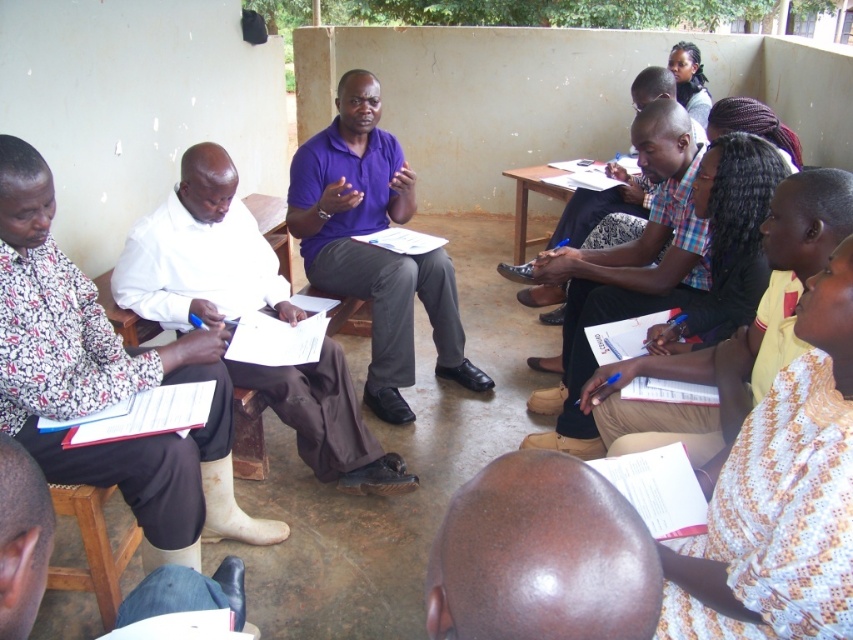
Who is positioned more to the left, shiny brown head at center or light brown fabric at center?

shiny brown head at center

Measure the distance from shiny brown head at center to light brown fabric at center.

shiny brown head at center is 1.79 meters away from light brown fabric at center.

Between point (519, 637) and point (595, 310), which one is positioned behind?

The point (595, 310) is more distant.

Locate an element on the screen. Image resolution: width=853 pixels, height=640 pixels. shiny brown head at center is located at coordinates (541, 556).

From the picture: Who is higher up, white printed dress at lower right or purple matte shirt at center?

Positioned higher is purple matte shirt at center.

Can you confirm if white printed dress at lower right is positioned to the right of purple matte shirt at center?

Correct, you'll find white printed dress at lower right to the right of purple matte shirt at center.

Is point (727, 566) positioned behind point (410, 337)?

No, (727, 566) is closer to viewer.

Where is `white printed dress at lower right`? This screenshot has height=640, width=853. white printed dress at lower right is located at coordinates (781, 497).

Does white matte shirt at left have a larger size compared to purple matte shirt at center?

Actually, white matte shirt at left might be smaller than purple matte shirt at center.

Is white matte shirt at left above purple matte shirt at center?

Actually, white matte shirt at left is below purple matte shirt at center.

Who is more distant from viewer, (39, 339) or (393, 177)?

Point (393, 177)

The height and width of the screenshot is (640, 853). I want to click on white matte shirt at left, so click(107, 384).